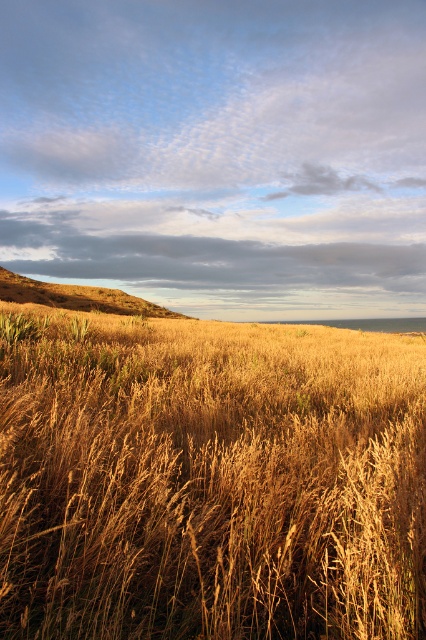
You are standing in the field and want to walk to the golden grassy hillside at upper left. Which direction should you move relative to the golden dry grass at center?

Since the golden dry grass at center is smaller in size compared to the golden grassy hillside at upper left, you should move towards the upper left direction away from the golden dry grass at center to reach the golden grassy hillside at upper left.

You are a hiker standing at the edge of the golden dry grass at center and looking towards the golden grassy hillside at upper left. Which area has taller grass?

The golden grassy hillside at upper left has taller grass compared to the golden dry grass at center.